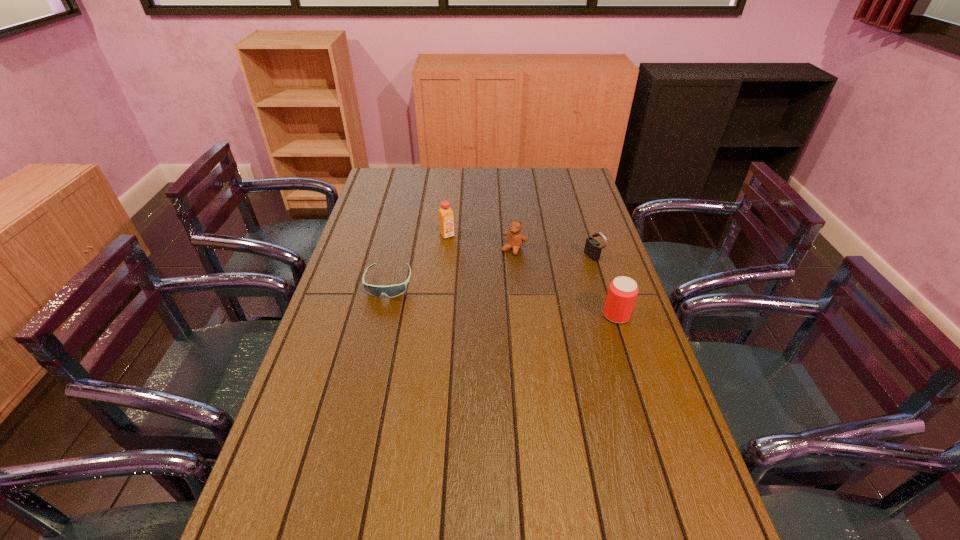
Identify the location of vacant area between the beer can and the teddy bear. (565, 282).

This screenshot has height=540, width=960. Find the location of `free space between the padlock and the beer can`. free space between the padlock and the beer can is located at coordinates (605, 286).

You are a GUI agent. You are given a task and a screenshot of the screen. Output one action in this format:
    pyautogui.click(x=<x>, y=<y>)
    Task: Click on the empty space between the orange juice and the teddy bear
    This screenshot has height=540, width=960.
    Given the screenshot: What is the action you would take?
    pyautogui.click(x=481, y=242)

Where is `free space between the leftmost object and the beer can`? This screenshot has height=540, width=960. free space between the leftmost object and the beer can is located at coordinates (502, 299).

Identify the location of empty location between the third object from left to right and the nearest object. (565, 282).

Locate an element on the screen. The height and width of the screenshot is (540, 960). vacant region between the teddy bear and the padlock is located at coordinates (554, 253).

Identify the location of empty space between the teddy bear and the farthest object. The image size is (960, 540). (481, 242).

In order to click on object that is the closest to the orange juice in this screenshot , I will do 515,238.

Locate an element on the screen. This screenshot has width=960, height=540. object that stands as the second closest to the beer can is located at coordinates (515, 238).